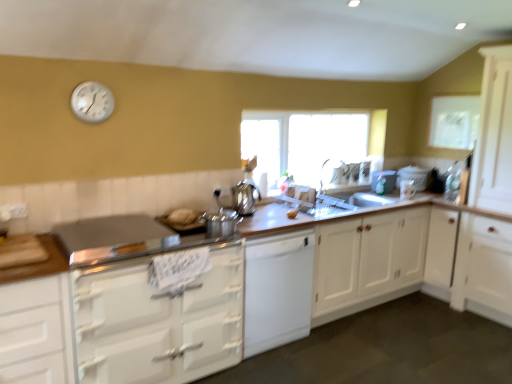
The width and height of the screenshot is (512, 384). Describe the element at coordinates (395, 257) in the screenshot. I see `white wood cabinets at center, the second cabinetry positioned from the right` at that location.

Describe the element at coordinates (221, 223) in the screenshot. Image resolution: width=512 pixels, height=384 pixels. I see `metallic silver pot at center, arranged as the first appliance when viewed from the front` at that location.

The width and height of the screenshot is (512, 384). What do you see at coordinates (413, 176) in the screenshot?
I see `white glossy crock pot at upper right, which ranks as the 3th appliance in left-to-right order` at bounding box center [413, 176].

The height and width of the screenshot is (384, 512). Identify the location of yellow matte apple at center. (292, 214).

Is white glossy crock pot at upper right, which appears as the first appliance when viewed from the back, oriented towards yellow matte apple at center?

No.

Image resolution: width=512 pixels, height=384 pixels. Identify the location of food below the white glossy crock pot at upper right, positioned as the third appliance in front-to-back order (from the image's perspective). (292, 214).

From a real-world perspective, does white glossy crock pot at upper right, marked as the first appliance in a right-to-left arrangement, sit lower than yellow matte apple at center?

No, from a real-world perspective, white glossy crock pot at upper right, marked as the first appliance in a right-to-left arrangement, is not beneath yellow matte apple at center.

Would you say white glossy crock pot at upper right, which ranks as the 3th appliance in left-to-right order, contains yellow matte apple at center?

Definitely not — yellow matte apple at center is not inside white glossy crock pot at upper right, which ranks as the 3th appliance in left-to-right order.

Which is behind, white paper at upper right or metallic silver kettle at upper right, arranged as the second appliance when viewed from the right?

metallic silver kettle at upper right, arranged as the second appliance when viewed from the right.

Which of these two, white paper at upper right or metallic silver kettle at upper right, arranged as the second appliance when viewed from the right, stands shorter?

metallic silver kettle at upper right, arranged as the second appliance when viewed from the right, is shorter.

Find the location of a particular element. window screen located on the right of metallic silver kettle at upper right, the 2th appliance in the back-to-front sequence is located at coordinates (454, 121).

From a real-world perspective, between white paper at upper right and metallic silver kettle at upper right, arranged as the second appliance when viewed from the right, who is vertically higher?

white paper at upper right is physically above.

Who is taller, satin silver kettle at center or white wood cabinet at center, acting as the fourth cabinetry starting from the left?

white wood cabinet at center, acting as the fourth cabinetry starting from the left.

In terms of size, does satin silver kettle at center appear bigger or smaller than white wood cabinet at center, acting as the fourth cabinetry starting from the left?

Clearly, satin silver kettle at center is smaller in size than white wood cabinet at center, acting as the fourth cabinetry starting from the left.

Which object is more forward, satin silver kettle at center or white wood cabinet at center, the first cabinetry in the right-to-left sequence?

Positioned in front is satin silver kettle at center.

From the image's perspective, between satin silver kettle at center and white wood cabinet at center, acting as the fourth cabinetry starting from the left, who is located below?

From the image's view, white wood cabinet at center, acting as the fourth cabinetry starting from the left, is below.

At what (x,y) coordinates should I click in order to perform the action: click on window screen behind the white wood cabinet at center, acting as the fourth cabinetry starting from the left. Please return your answer as a coordinate pair (x, y). Looking at the image, I should click on (454, 121).

Considering the positions of points (440, 125) and (385, 239), is point (440, 125) closer to camera compared to point (385, 239)?

No.

Does white paper at upper right touch white wood cabinet at center, the first cabinetry in the right-to-left sequence?

No, white paper at upper right is not next to white wood cabinet at center, the first cabinetry in the right-to-left sequence.

I want to click on window screen to the right of metallic silver pot at center, placed as the 3th appliance when sorted from back to front, so click(454, 121).

Is metallic silver pot at center, the 3th appliance in the right-to-left sequence, touching white paper at upper right?

metallic silver pot at center, the 3th appliance in the right-to-left sequence, and white paper at upper right are clearly separated.

Between metallic silver pot at center, arranged as the first appliance when viewed from the front, and white paper at upper right, which one is positioned behind?

white paper at upper right is further away from the camera.

Considering the relative sizes of metallic silver pot at center, arranged as the first appliance when viewed from the front, and white paper at upper right in the image provided, is metallic silver pot at center, arranged as the first appliance when viewed from the front, wider than white paper at upper right?

Yes.

Considering the points (332, 233) and (291, 218), which point is behind, point (332, 233) or point (291, 218)?

Positioned behind is point (332, 233).

From a real-world perspective, which is physically above, white wood cabinets at center, the 3th cabinetry in the left-to-right sequence, or yellow matte apple at center?

yellow matte apple at center.

Where is `food behind the white wood cabinets at center, the 3th cabinetry in the left-to-right sequence`? This screenshot has width=512, height=384. food behind the white wood cabinets at center, the 3th cabinetry in the left-to-right sequence is located at coordinates click(292, 214).

From the image's perspective, is white wood cabinets at center, the second cabinetry positioned from the right, above or below yellow matte apple at center?

white wood cabinets at center, the second cabinetry positioned from the right, is situated lower than yellow matte apple at center in the image.

Who is smaller, white wood cabinets at center, the 3th cabinetry in the left-to-right sequence, or metallic silver pot at center, placed as the 3th appliance when sorted from back to front?

metallic silver pot at center, placed as the 3th appliance when sorted from back to front.

Can you tell me how much white wood cabinets at center, the 3th cabinetry in the left-to-right sequence, and metallic silver pot at center, arranged as the 1th appliance when viewed from the left, differ in facing direction?

The angle between the facing direction of white wood cabinets at center, the 3th cabinetry in the left-to-right sequence, and the facing direction of metallic silver pot at center, arranged as the 1th appliance when viewed from the left, is 0.000738 degrees.

Is white wood cabinets at center, the second cabinetry positioned from the right, not close to metallic silver pot at center, the 3th appliance in the right-to-left sequence?

Yes.

Is metallic silver pot at center, arranged as the 1th appliance when viewed from the left, inside white wood cabinets at center, the 3th cabinetry in the left-to-right sequence?

No, metallic silver pot at center, arranged as the 1th appliance when viewed from the left, is located outside of white wood cabinets at center, the 3th cabinetry in the left-to-right sequence.

Identify the location of appliance that is the 2nd object to the right of the yellow matte apple at center, starting at the anchor. (413, 176).

Locate an element on the screen. Image resolution: width=512 pixels, height=384 pixels. the 2nd appliance to the left of the white paper at upper right, starting your count from the anchor is located at coordinates (383, 181).

Based on their spatial positions, is silver metallic clock at upper left or yellow matte apple at center further from metallic silver kettle at upper right, arranged as the 2th appliance when viewed from the front?

The object further to metallic silver kettle at upper right, arranged as the 2th appliance when viewed from the front, is silver metallic clock at upper left.

When comparing their distances from metallic silver kettle at upper right, which appears as the 2th appliance when viewed from the left, does white wood cabinet at center, the first cabinetry in the right-to-left sequence, or white matte dishwasher at center, marked as the third cabinetry in a right-to-left arrangement, seem closer?

Among the two, white wood cabinet at center, the first cabinetry in the right-to-left sequence, is located nearer to metallic silver kettle at upper right, which appears as the 2th appliance when viewed from the left.

Estimate the real-world distances between objects in this image. Which object is closer to white wood cabinet at center, the first cabinetry in the right-to-left sequence, satin silver kettle at center or yellow matte apple at center?

Among the two, yellow matte apple at center is located nearer to white wood cabinet at center, the first cabinetry in the right-to-left sequence.

Looking at the image, which one is located further to white matte dishwasher at center, marked as the third cabinetry in a right-to-left arrangement, metallic silver pot at center, arranged as the 1th appliance when viewed from the left, or white glossy crock pot at upper right, positioned as the third appliance in front-to-back order?

Based on the image, white glossy crock pot at upper right, positioned as the third appliance in front-to-back order, appears to be further to white matte dishwasher at center, marked as the third cabinetry in a right-to-left arrangement.

Which object lies nearer to the anchor point white wood cabinets at center, the second cabinetry positioned from the right, silver metallic clock at upper left or white wood cabinet at center, the first cabinetry in the right-to-left sequence?

white wood cabinet at center, the first cabinetry in the right-to-left sequence, is positioned closer to the anchor white wood cabinets at center, the second cabinetry positioned from the right.

When comparing their distances from metallic silver kettle at upper right, the 2th appliance in the back-to-front sequence, does white glossy crock pot at upper right, positioned as the third appliance in front-to-back order, or yellow matte apple at center seem further?

Based on the image, yellow matte apple at center appears to be further to metallic silver kettle at upper right, the 2th appliance in the back-to-front sequence.

Estimate the real-world distances between objects in this image. Which object is closer to white wood cabinet at center, acting as the fourth cabinetry starting from the left, metallic silver kettle at upper right, arranged as the 2th appliance when viewed from the front, or satin silver kettle at center?

The object closer to white wood cabinet at center, acting as the fourth cabinetry starting from the left, is metallic silver kettle at upper right, arranged as the 2th appliance when viewed from the front.

Estimate the real-world distances between objects in this image. Which object is further from white glossy cabinet at lower left, which appears as the 1th cabinetry when viewed from the left, white wood cabinets at center, the second cabinetry positioned from the right, or white paper at upper right?

Among the two, white paper at upper right is located further to white glossy cabinet at lower left, which appears as the 1th cabinetry when viewed from the left.

Where is `kitchen appliance positioned between white wood cabinets at center, the 3th cabinetry in the left-to-right sequence, and clear glass window at center from near to far`? The width and height of the screenshot is (512, 384). kitchen appliance positioned between white wood cabinets at center, the 3th cabinetry in the left-to-right sequence, and clear glass window at center from near to far is located at coordinates (245, 197).

This screenshot has height=384, width=512. Identify the location of window situated between silver metallic clock at upper left and white wood cabinets at center, the 3th cabinetry in the left-to-right sequence, from left to right. (309, 140).

Locate an element on the screen. food between clear glass window at center and white wood cabinet at center, acting as the fourth cabinetry starting from the left, from top to bottom is located at coordinates (292, 214).

Where is `window between white glossy cabinet at lower left, marked as the 4th cabinetry in a right-to-left arrangement, and white glossy crock pot at upper right, marked as the first appliance in a right-to-left arrangement`? This screenshot has width=512, height=384. window between white glossy cabinet at lower left, marked as the 4th cabinetry in a right-to-left arrangement, and white glossy crock pot at upper right, marked as the first appliance in a right-to-left arrangement is located at coordinates (309, 140).